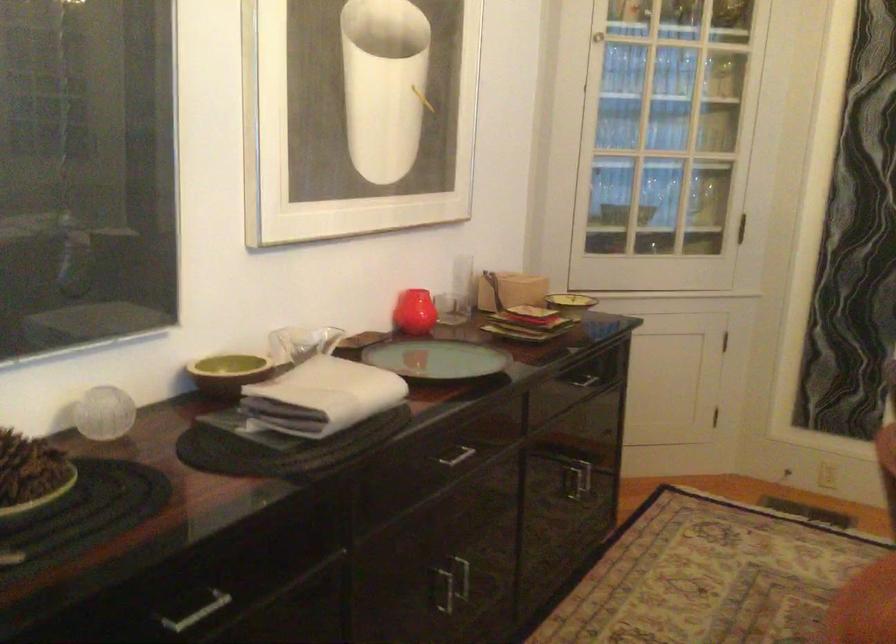
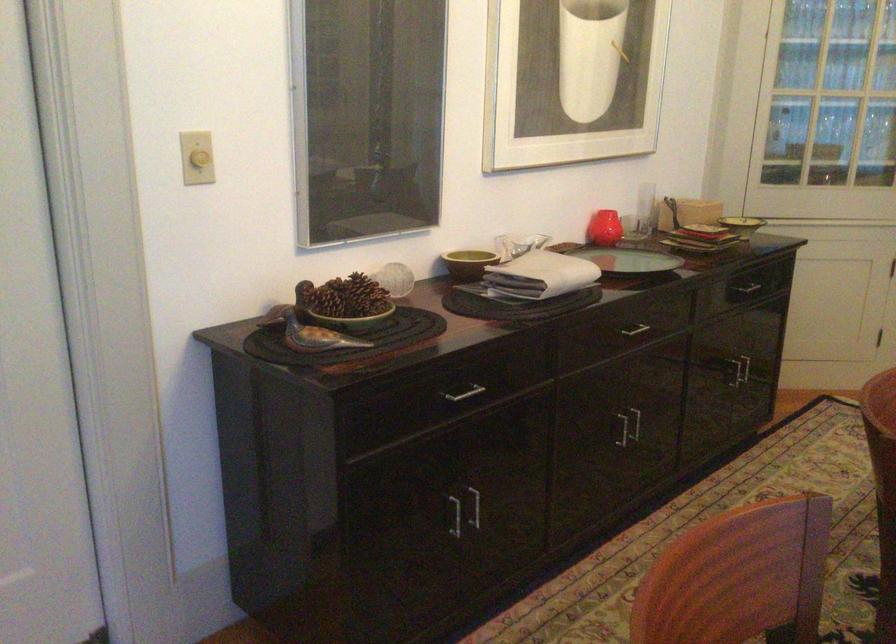
The point at (227, 379) is marked in the first image. Where is the corresponding point in the second image?

(468, 263)